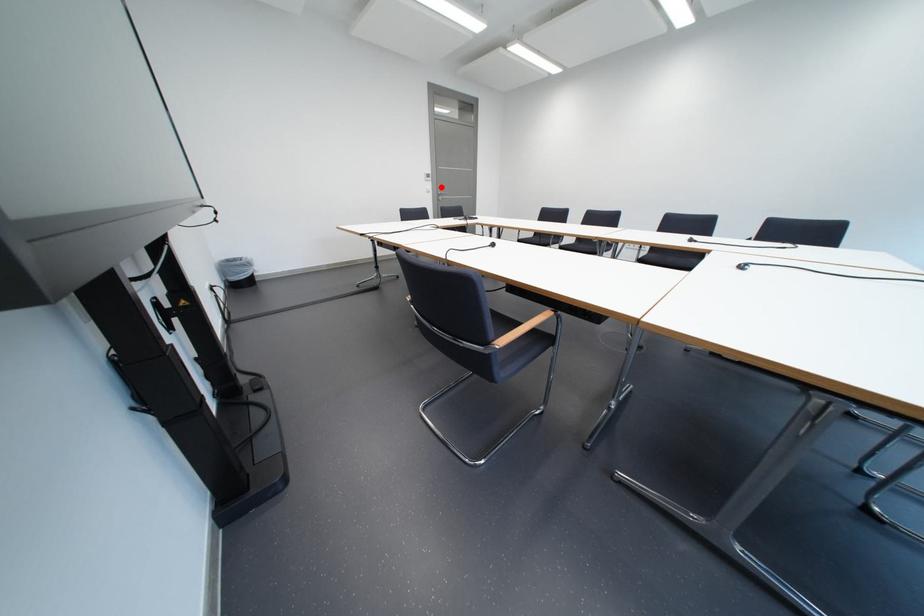
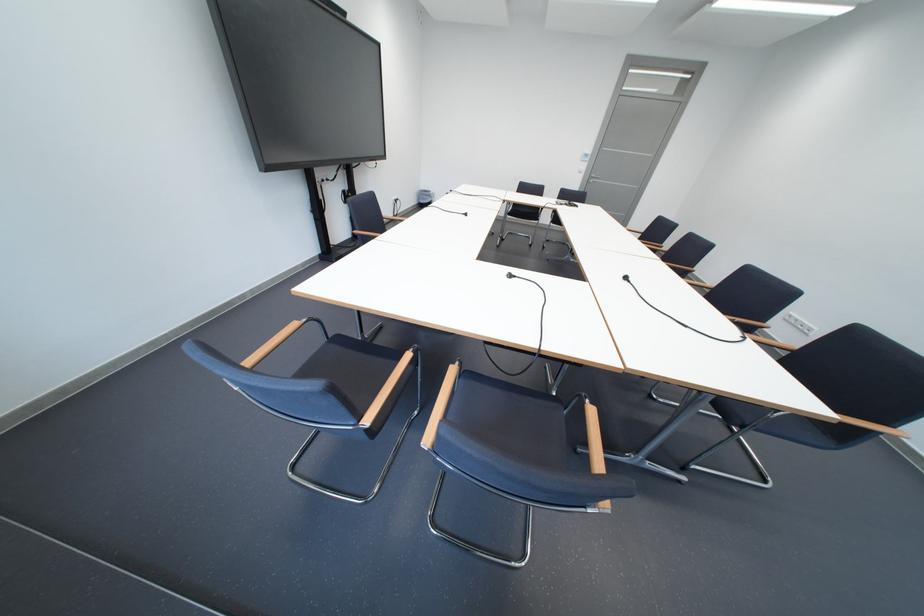
Question: A red point is marked in image1. In image2, is the corresponding 3D point closer to the camera or farther? Reply with the corresponding letter.

Choices:
 (A) The corresponding 3D point is closer.
 (B) The corresponding 3D point is farther.

Answer: (B)